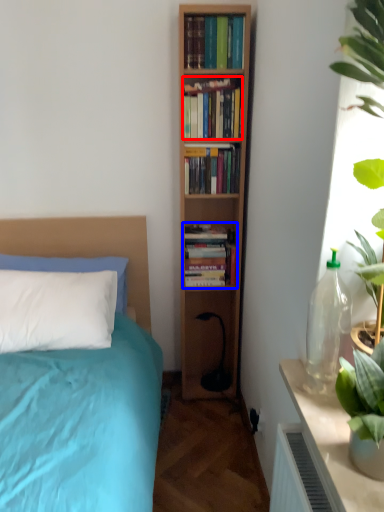
Question: Which object is further to the camera taking this photo, book (highlighted by a red box) or book (highlighted by a blue box)?

Choices:
 (A) book
 (B) book

Answer: (B)